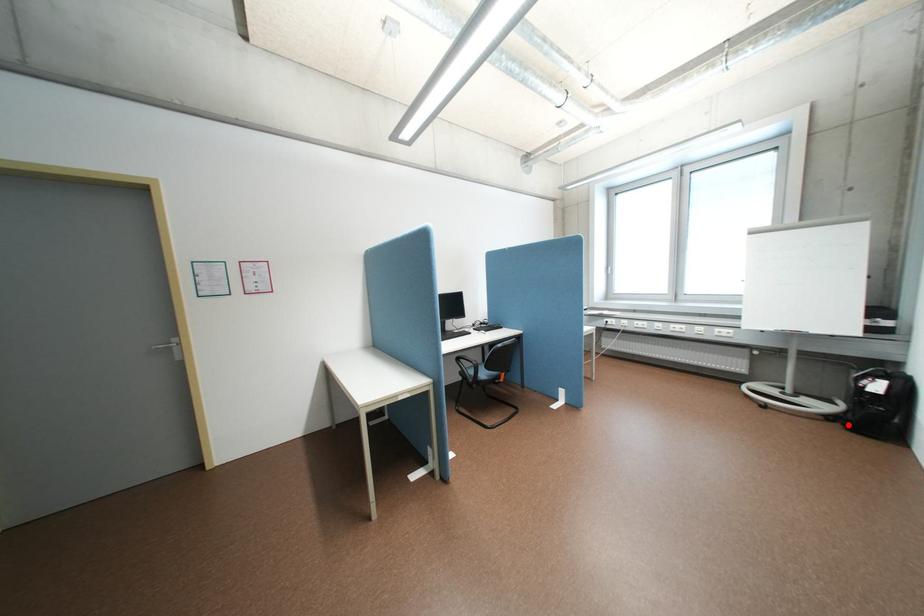
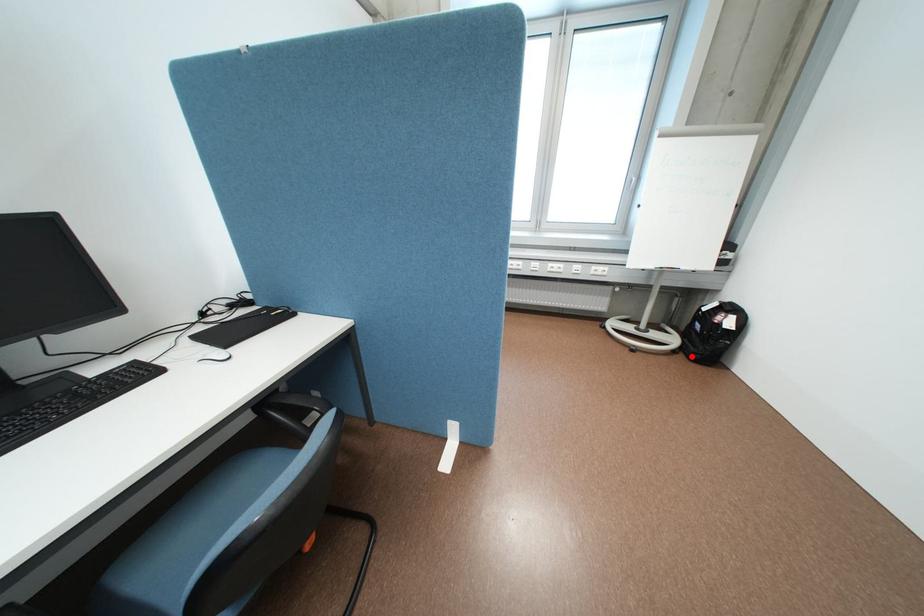
I am providing you with two images of the same scene from different viewpoints. A red point is marked on the first image and another point is marked on the second image. Are the points marked in image1 and image2 representing the same 3D position?

Yes